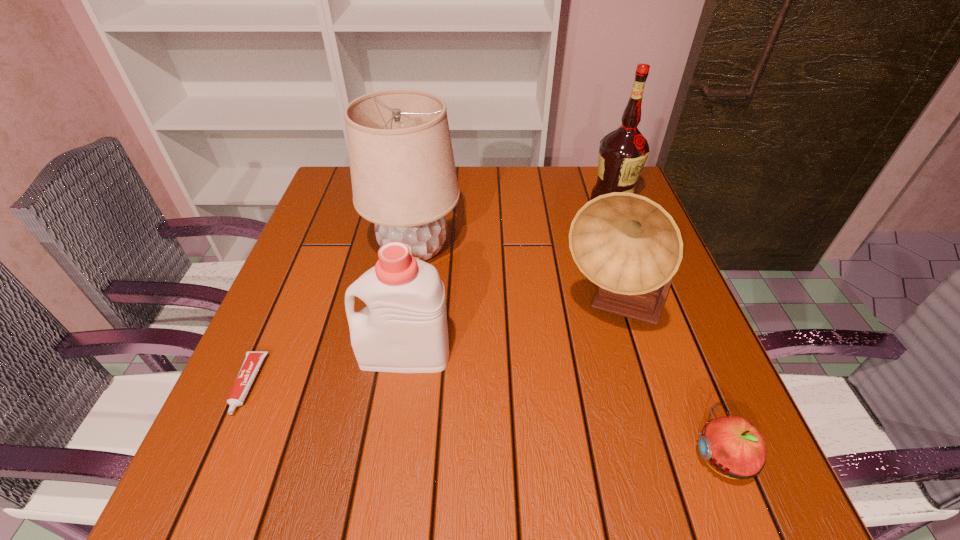
This screenshot has width=960, height=540. In order to click on alcohol in this screenshot , I will do `click(623, 152)`.

You are a GUI agent. You are given a task and a screenshot of the screen. Output one action in this format:
    pyautogui.click(x=<x>, y=<y>)
    Task: Click on the lampshade
    
    Given the screenshot: What is the action you would take?
    pyautogui.click(x=403, y=174)

The width and height of the screenshot is (960, 540). I want to click on phonograph record, so click(628, 245).

Image resolution: width=960 pixels, height=540 pixels. Identify the location of the third shortest object. (403, 329).

What are the coordinates of `the nearest object` in the screenshot? It's located at (732, 445).

Find the location of `apple`. apple is located at coordinates (732, 445).

I want to click on the leftmost object, so click(253, 359).

This screenshot has width=960, height=540. I want to click on toothpaste, so click(x=253, y=359).

Locate an element on the screen. free space located 0.330m on the label of the farthest object is located at coordinates (651, 305).

In order to click on vacant space located 0.260m on the back of the lampshade in this screenshot , I will do `click(427, 169)`.